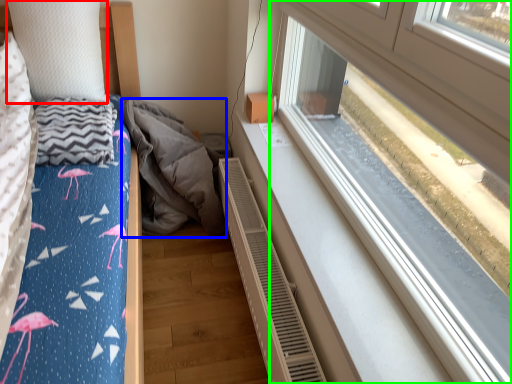
Question: Estimate the real-world distances between objects in this image. Which object is closer to pillow (highlighted by a red box), material (highlighted by a blue box) or window (highlighted by a green box)?

Choices:
 (A) material
 (B) window

Answer: (A)